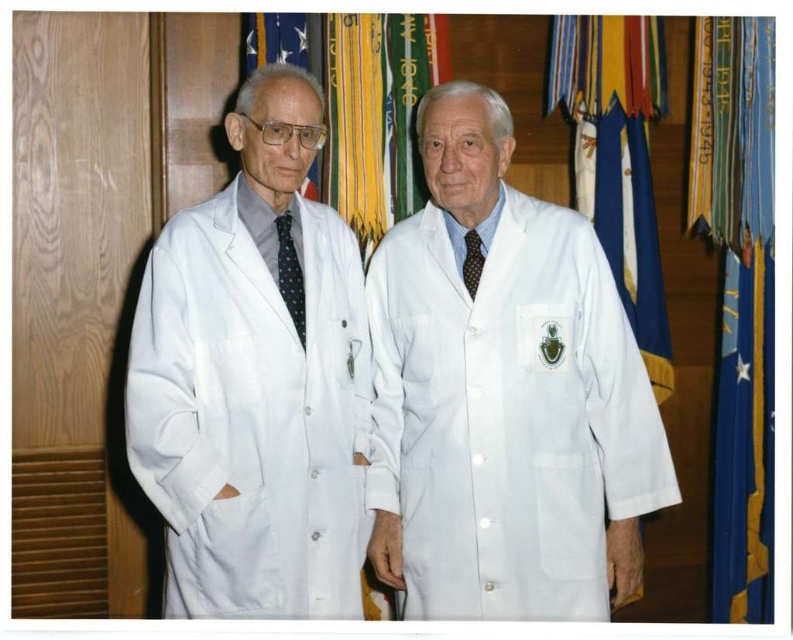
You are a photographer setting up for a group photo. You notice the white matte lab coat at center and the blue fabric flag at center in the background. To ensure both are visible in the frame, which object should you focus on first?

The white matte lab coat at center is below the blue fabric flag at center, so you should focus on the blue fabric flag at center first to ensure both are in the frame.

You are standing in the room where the two elderly men are. You need to locate the white matte lab coat at center. Where is it located in terms of coordinates?

The white matte lab coat at center is located at coordinates point (508,413).